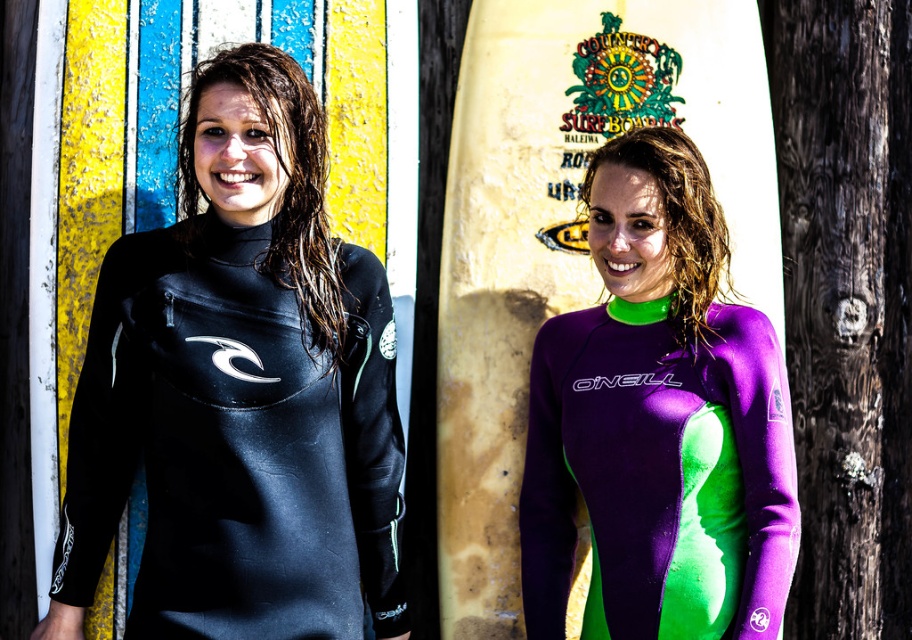
Is black neoprene wetsuit at left to the left of yellow matte surfboard at center from the viewer's perspective?

Correct, you'll find black neoprene wetsuit at left to the left of yellow matte surfboard at center.

I want to click on black neoprene wetsuit at left, so click(240, 392).

This screenshot has height=640, width=912. What do you see at coordinates (240, 392) in the screenshot? I see `black neoprene wetsuit at left` at bounding box center [240, 392].

Where is `black neoprene wetsuit at left`? black neoprene wetsuit at left is located at coordinates (240, 392).

Is point (340, 371) closer to viewer compared to point (541, 413)?

Yes, point (340, 371) is closer to viewer.

Locate an element on the screen. The width and height of the screenshot is (912, 640). black neoprene wetsuit at left is located at coordinates (240, 392).

Is point (566, 177) farther from viewer compared to point (532, 525)?

No, (566, 177) is closer to viewer.

Does yellow matte surfboard at center have a lesser width compared to purple/green neoprene wetsuit at center?

Incorrect, yellow matte surfboard at center's width is not less than purple/green neoprene wetsuit at center's.

Locate an element on the screen. yellow matte surfboard at center is located at coordinates (563, 230).